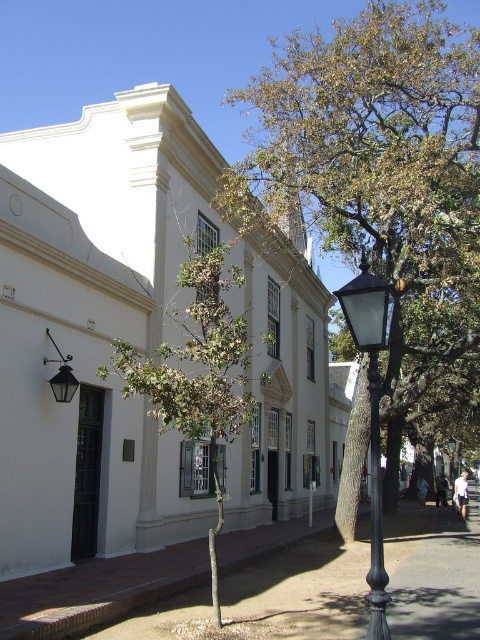
Question: Can you confirm if brown gravel pavement at lower left is bigger than green leafy tree at center?

Choices:
 (A) no
 (B) yes

Answer: (B)

Question: Considering the relative positions of brown gravel pavement at lower left and green leafy tree at center in the image provided, where is brown gravel pavement at lower left located with respect to green leafy tree at center?

Choices:
 (A) left
 (B) right

Answer: (B)

Question: Which point is closer to the camera?

Choices:
 (A) (71, 371)
 (B) (468, 586)
 (C) (267, 141)
 (D) (130, 353)

Answer: (D)

Question: Among these objects, which one is nearest to the camera?

Choices:
 (A) matte black lamp at left
 (B) green leafy tree at center

Answer: (B)

Question: Which point is closer to the camera?

Choices:
 (A) black metal streetlight at center
 (B) black glass lamp post at right
 (C) matte black lamp at left

Answer: (B)

Question: Is brown gravel pavement at lower left positioned in front of black metal streetlight at center?

Choices:
 (A) no
 (B) yes

Answer: (B)